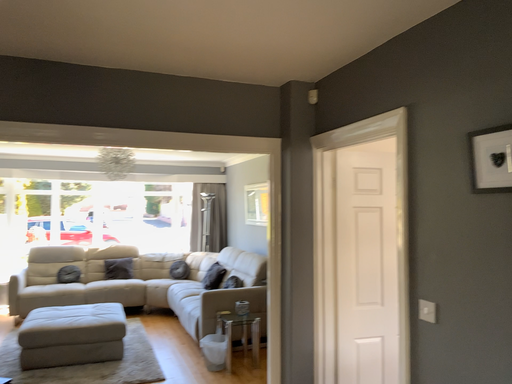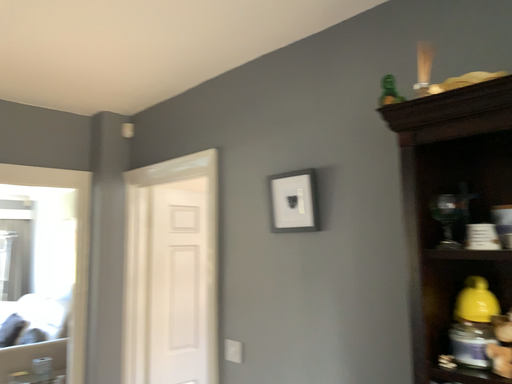
Question: How did the camera likely rotate when shooting the video?

Choices:
 (A) rotated right
 (B) rotated left

Answer: (A)